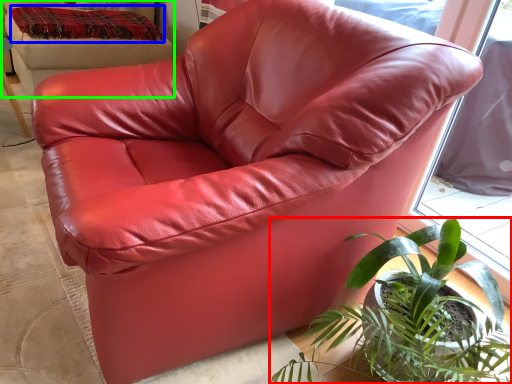
Question: Which object is positioned farthest from houseplant (highlighted by a red box)? Select from blanket (highlighted by a blue box) and bean bag chair (highlighted by a green box).

Choices:
 (A) blanket
 (B) bean bag chair

Answer: (A)